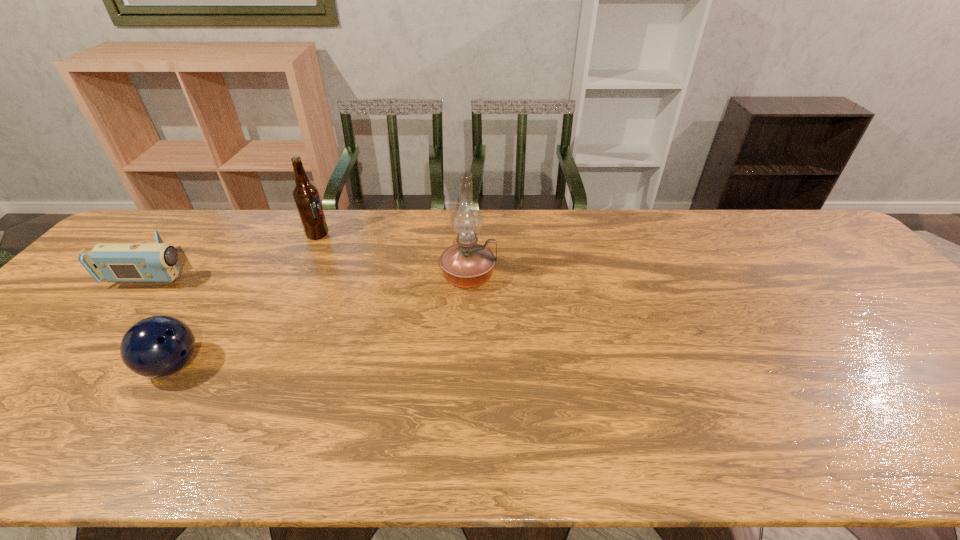
You are a GUI agent. You are given a task and a screenshot of the screen. Output one action in this format:
    pyautogui.click(x=<x>, y=<y>)
    Task: Click on the vacant space that satisfies the following two spatial constraints: 1. on the back side of the rightmost object; 2. on the label of the beer bottle
    The image size is (960, 540).
    Given the screenshot: What is the action you would take?
    pyautogui.click(x=469, y=235)

The height and width of the screenshot is (540, 960). In order to click on vacant space that satisfies the following two spatial constraints: 1. on the label of the tallest object; 2. on the left side of the farthest object in this screenshot , I will do `click(299, 275)`.

Image resolution: width=960 pixels, height=540 pixels. What are the coordinates of `blank area in the image that satisfies the following two spatial constraints: 1. on the label of the farthest object; 2. on the back side of the oil lamp` in the screenshot? It's located at (299, 275).